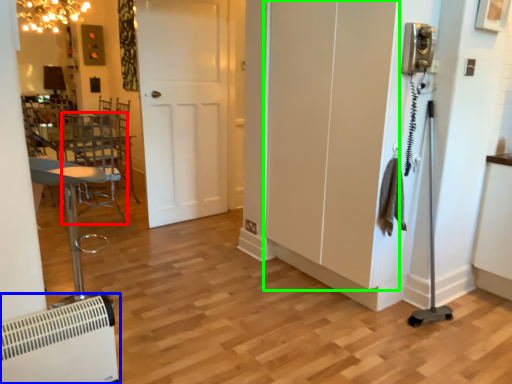
Question: Which object is the closest to the swivel chair (highlighted by a red box)? Choose among these: air conditioning (highlighted by a blue box) or screen door (highlighted by a green box).

Choices:
 (A) air conditioning
 (B) screen door

Answer: (B)